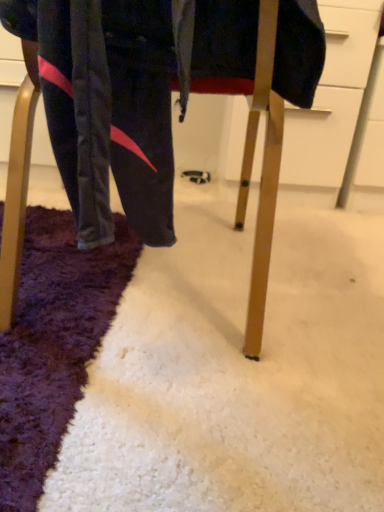
Identify the location of wooden chair at center. (262, 175).

The height and width of the screenshot is (512, 384). What do you see at coordinates (262, 175) in the screenshot?
I see `wooden chair at center` at bounding box center [262, 175].

Identify the location of wooden chair at center. (262, 175).